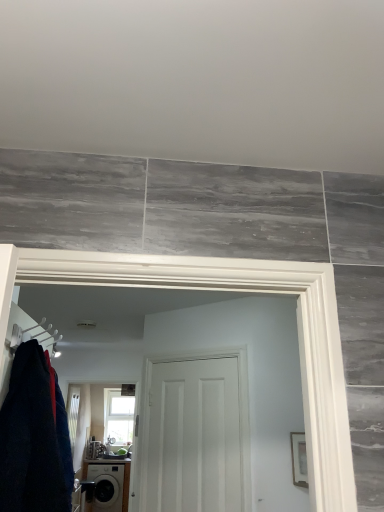
Question: Is matte black washing machine at lower left situated inside clear glass window at upper center or outside?

Choices:
 (A) inside
 (B) outside

Answer: (B)

Question: Considering the positions of point (97, 485) and point (112, 433), is point (97, 485) closer or farther from the camera than point (112, 433)?

Choices:
 (A) closer
 (B) farther

Answer: (A)

Question: Considering the real-world distances, which object is closest to the white plastic hanger at left?

Choices:
 (A) clear glass window at upper center
 (B) matte black washing machine at lower left
 (C) white matte ceiling at upper center
 (D) white matte door at center
 (E) dark blue fabric at left

Answer: (E)

Question: Based on their relative distances, which object is nearer to the white plastic hanger at left?

Choices:
 (A) white matte ceiling at upper center
 (B) matte black washing machine at lower left
 (C) white matte door at center
 (D) dark blue fabric at left
 (E) clear glass window at upper center

Answer: (D)